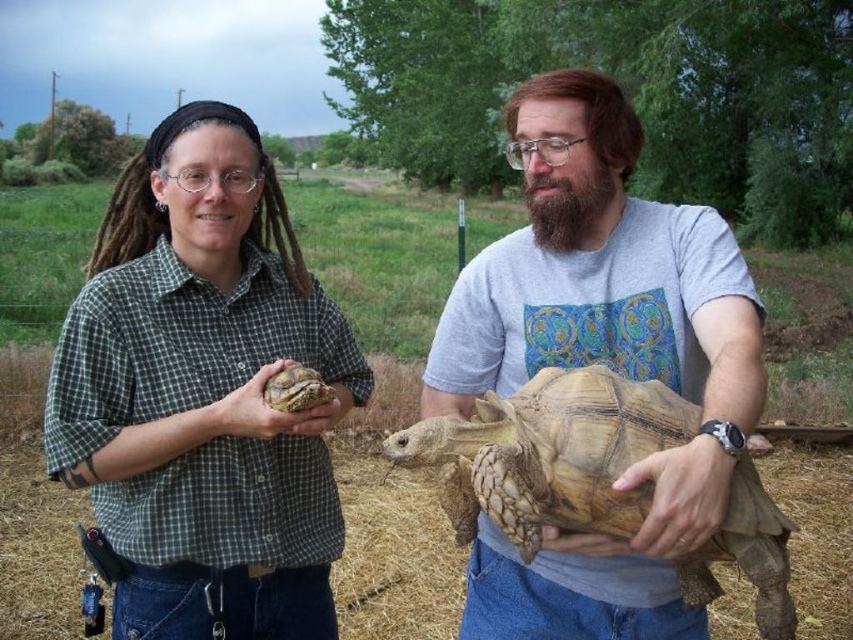
Is brown rough skin at lower right bigger than matte brown tortoise at center?

Correct, brown rough skin at lower right is larger in size than matte brown tortoise at center.

Between brown rough skin at lower right and matte brown tortoise at center, which one appears on the left side from the viewer's perspective?

matte brown tortoise at center

Who is more distant from viewer, (x=677, y=497) or (x=341, y=413)?

The point (x=341, y=413) is behind.

Locate an element on the screen. The height and width of the screenshot is (640, 853). brown rough skin at lower right is located at coordinates (680, 496).

Is green checkered shirt at center below matte gray t-shirt at center?

Indeed, green checkered shirt at center is positioned under matte gray t-shirt at center.

Is point (300, 262) behind point (672, 259)?

Yes, point (300, 262) is behind point (672, 259).

Is point (126, 202) positioned before point (614, 344)?

No, it is behind (614, 344).

Find the location of a particular element. The height and width of the screenshot is (640, 853). green checkered shirt at center is located at coordinates (202, 394).

Can you confirm if matte gray t-shirt at center is positioned above leathery brown tortoise at center?

Indeed, matte gray t-shirt at center is positioned over leathery brown tortoise at center.

Does matte gray t-shirt at center have a lesser width compared to leathery brown tortoise at center?

Correct, matte gray t-shirt at center's width is less than leathery brown tortoise at center's.

The width and height of the screenshot is (853, 640). What are the coordinates of `matte gray t-shirt at center` in the screenshot? It's located at (601, 360).